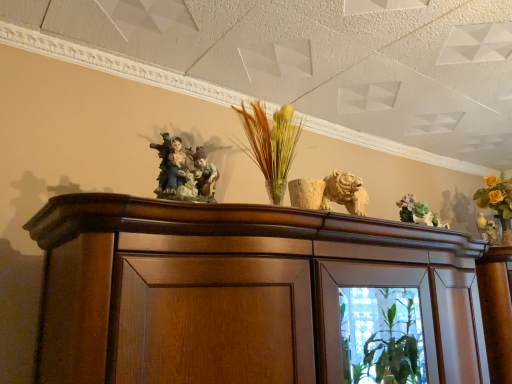
In the scene shown: Measure the distance between point (213, 176) and camera.

They are 1.09 meters apart.

What is the approximate height of matte porcelain figurine at center?

matte porcelain figurine at center is 8.45 inches in height.

At what (x,y) coordinates should I click in order to perform the action: click on matte porcelain figurine at center. Please return your answer as a coordinate pair (x, y). Image resolution: width=512 pixels, height=384 pixels. Looking at the image, I should click on (184, 172).

The width and height of the screenshot is (512, 384). Describe the element at coordinates (184, 172) in the screenshot. I see `matte porcelain figurine at center` at that location.

In order to click on green ceramic vase at upper right in this screenshot , I will do `click(417, 213)`.

Describe the element at coordinates (417, 213) in the screenshot. Image resolution: width=512 pixels, height=384 pixels. I see `green ceramic vase at upper right` at that location.

Identify the location of matte porcelain figurine at center. (184, 172).

Based on the photo, is matte porcelain figurine at center at the left side of green ceramic vase at upper right?

Correct, you'll find matte porcelain figurine at center to the left of green ceramic vase at upper right.

Is the position of matte porcelain figurine at center more distant than that of green ceramic vase at upper right?

No, matte porcelain figurine at center is closer to the camera.

Between point (191, 200) and point (413, 213), which one is positioned behind?

The point (413, 213) is farther.

From the image's perspective, between matte porcelain figurine at center and green ceramic vase at upper right, which one is located above?

matte porcelain figurine at center is shown above in the image.

From a real-world perspective, is matte porcelain figurine at center above or below green ceramic vase at upper right?

Clearly, from a real-world perspective, matte porcelain figurine at center is above green ceramic vase at upper right.

Can you confirm if matte porcelain figurine at center is wider than green ceramic vase at upper right?

Indeed, matte porcelain figurine at center has a greater width compared to green ceramic vase at upper right.

Does matte porcelain figurine at center have a lesser height compared to green ceramic vase at upper right?

No.

In terms of size, does matte porcelain figurine at center appear bigger or smaller than green ceramic vase at upper right?

Clearly, matte porcelain figurine at center is larger in size than green ceramic vase at upper right.

Is matte porcelain figurine at center spatially inside green ceramic vase at upper right, or outside of it?

matte porcelain figurine at center cannot be found inside green ceramic vase at upper right.

Is matte porcelain figurine at center not close to green ceramic vase at upper right?

No, there isn't a large distance between matte porcelain figurine at center and green ceramic vase at upper right.

Does matte porcelain figurine at center turn towards green ceramic vase at upper right?

No, matte porcelain figurine at center is not aimed at green ceramic vase at upper right.

Identify the location of floral arrangement lying on the right of matte porcelain figurine at center. This screenshot has height=384, width=512. (417, 213).

Considering the positions of objects green ceramic vase at upper right and matte porcelain figurine at center in the image provided, who is more to the left, green ceramic vase at upper right or matte porcelain figurine at center?

Positioned to the left is matte porcelain figurine at center.

Which is behind, green ceramic vase at upper right or matte porcelain figurine at center?

Positioned behind is green ceramic vase at upper right.

Is point (408, 212) behind point (170, 141)?

Yes, it is behind point (170, 141).

From the image's perspective, between green ceramic vase at upper right and matte porcelain figurine at center, which one is located above?

From the image's view, matte porcelain figurine at center is above.

From a real-world perspective, is green ceramic vase at upper right located beneath matte porcelain figurine at center?

Yes, from a real-world perspective, green ceramic vase at upper right is beneath matte porcelain figurine at center.

Can you confirm if green ceramic vase at upper right is thinner than matte porcelain figurine at center?

Correct, the width of green ceramic vase at upper right is less than that of matte porcelain figurine at center.

Is green ceramic vase at upper right taller or shorter than matte porcelain figurine at center?

Clearly, green ceramic vase at upper right is shorter compared to matte porcelain figurine at center.

Considering the relative sizes of green ceramic vase at upper right and matte porcelain figurine at center in the image provided, is green ceramic vase at upper right bigger than matte porcelain figurine at center?

Incorrect, green ceramic vase at upper right is not larger than matte porcelain figurine at center.

Is green ceramic vase at upper right positioned beyond the bounds of matte porcelain figurine at center?

Yes, green ceramic vase at upper right is not within matte porcelain figurine at center.

Is green ceramic vase at upper right positioned far away from matte porcelain figurine at center?

No.

Consider the image. Could you tell me if green ceramic vase at upper right is facing matte porcelain figurine at center?

No.

Identify the location of floral arrangement behind the matte porcelain figurine at center. (417, 213).

Image resolution: width=512 pixels, height=384 pixels. I want to click on floral arrangement that appears below the matte porcelain figurine at center (from a real-world perspective), so [x=417, y=213].

You are a GUI agent. You are given a task and a screenshot of the screen. Output one action in this format:
    pyautogui.click(x=<x>, y=<y>)
    Task: Click on the collection located above the green ceramic vase at upper right (from a real-world perspective)
    
    Given the screenshot: What is the action you would take?
    click(x=184, y=172)